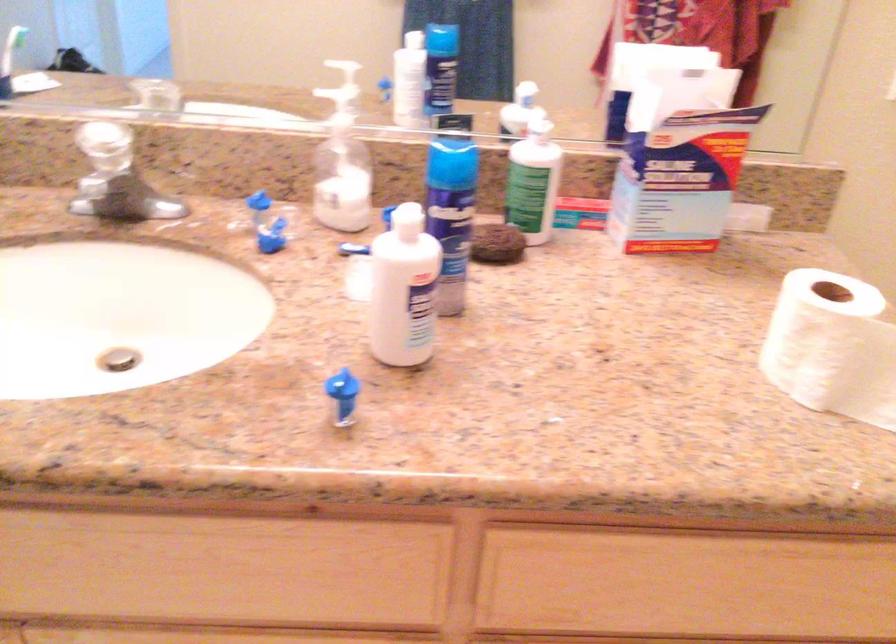
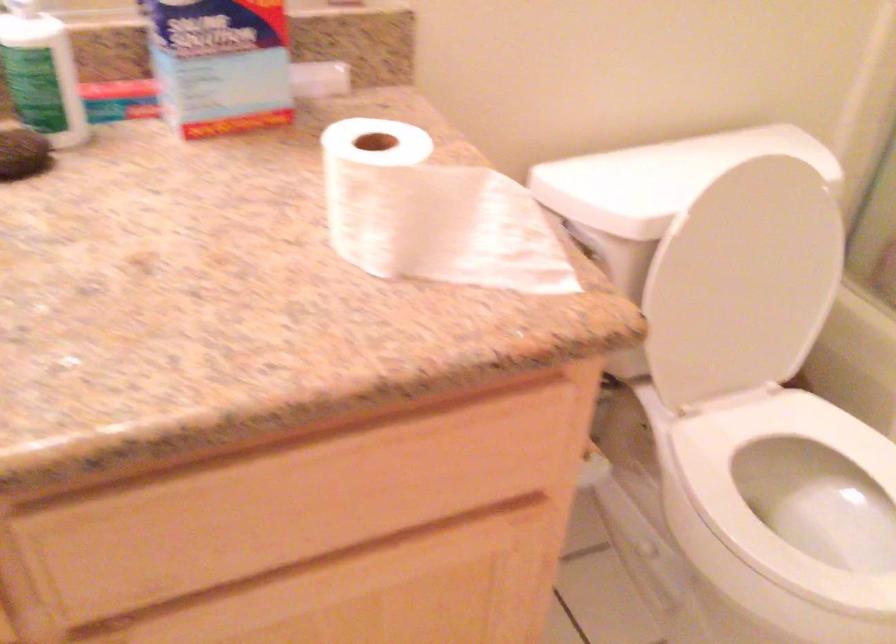
Question: The images are taken continuously from a first-person perspective. In which direction is your viewpoint rotating?

Choices:
 (A) Left
 (B) Right
 (C) Up
 (D) Down

Answer: (B)